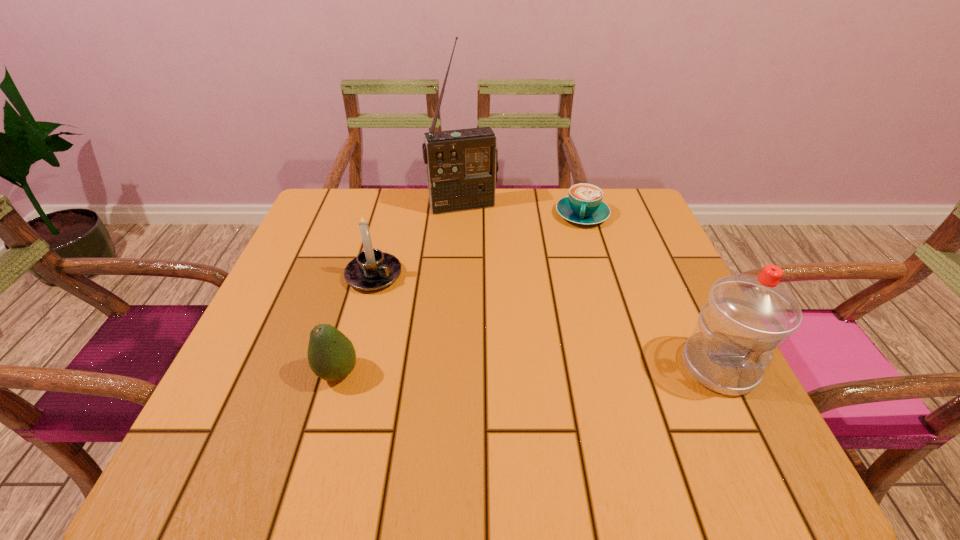
Find the location of `avocado`. avocado is located at coordinates pyautogui.click(x=331, y=355).

Locate an element on the screen. This screenshot has width=960, height=540. water bottle is located at coordinates (746, 317).

The image size is (960, 540). In order to click on the rightmost object in this screenshot , I will do `click(746, 317)`.

Locate an element on the screen. The height and width of the screenshot is (540, 960). the third nearest object is located at coordinates (372, 269).

Find the location of a particular element. the third tallest object is located at coordinates (372, 269).

This screenshot has height=540, width=960. I want to click on the shortest object, so click(584, 205).

I want to click on the fourth object from left to right, so click(584, 205).

Image resolution: width=960 pixels, height=540 pixels. What are the coordinates of `the third object from left to right` in the screenshot? It's located at (462, 165).

Locate an element on the screen. the tallest object is located at coordinates tap(462, 165).

Find the location of `free location located 0.070m on the back of the avocado`. free location located 0.070m on the back of the avocado is located at coordinates (350, 328).